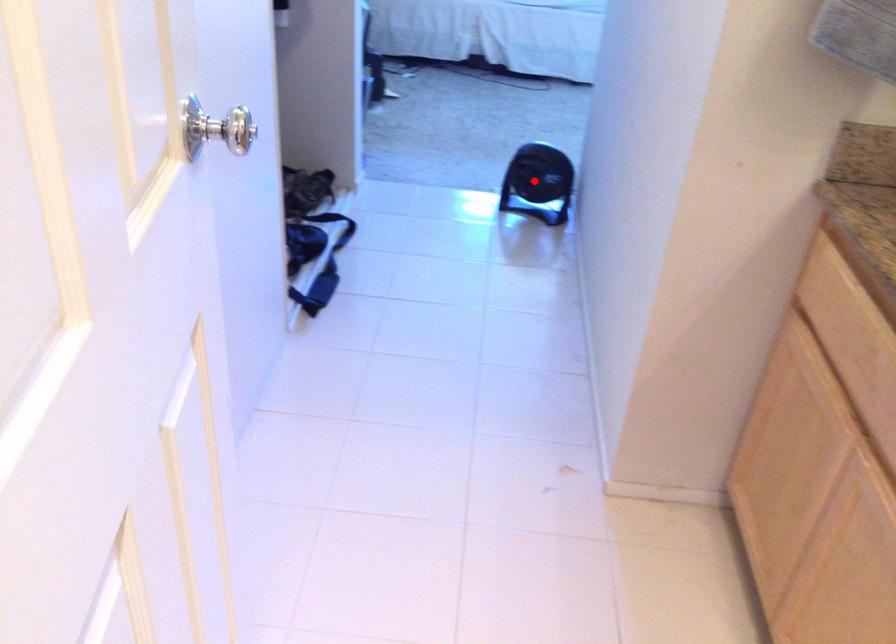
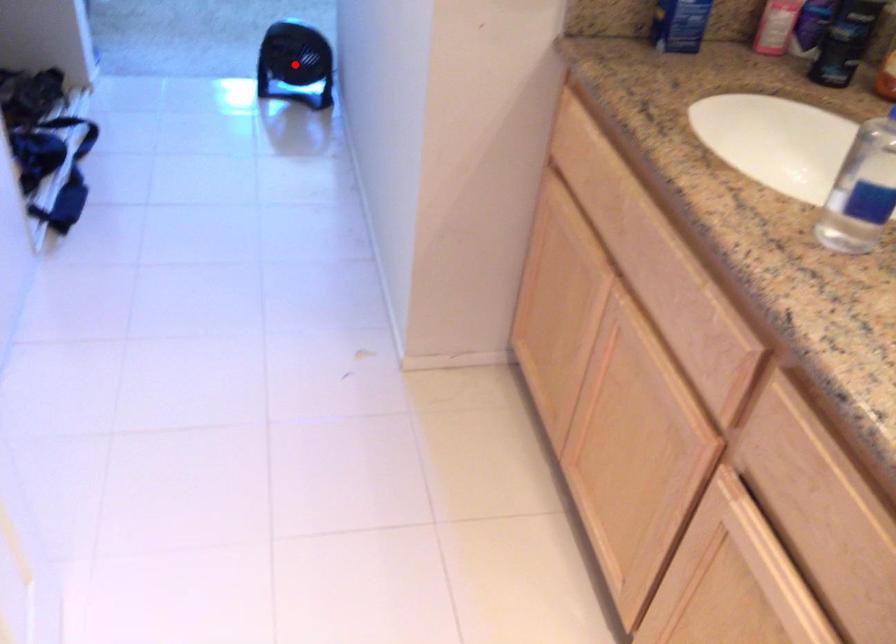
I am providing you with two images of the same scene from different viewpoints. A red point is marked on the first image and another point is marked on the second image. Are the points marked in image1 and image2 representing the same 3D position?

Yes